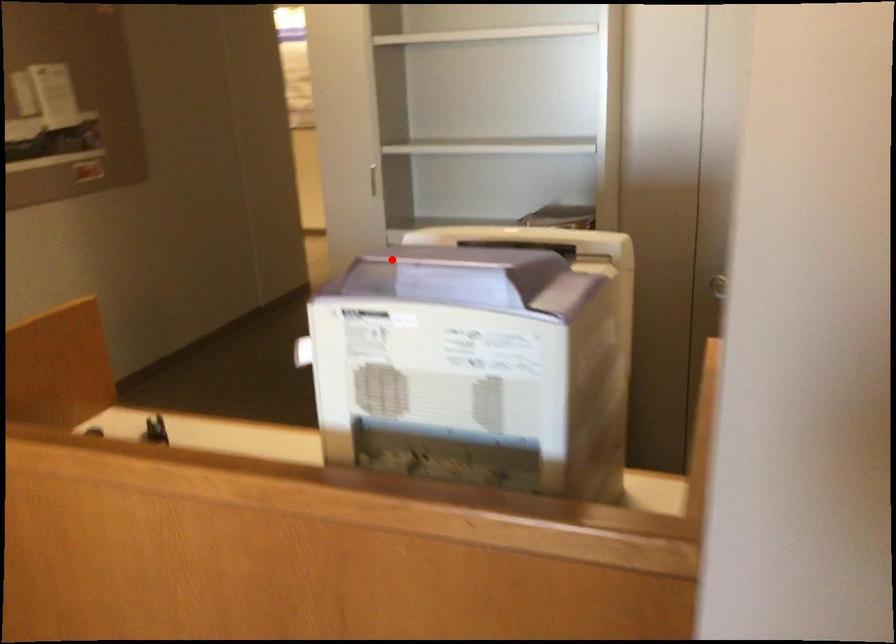
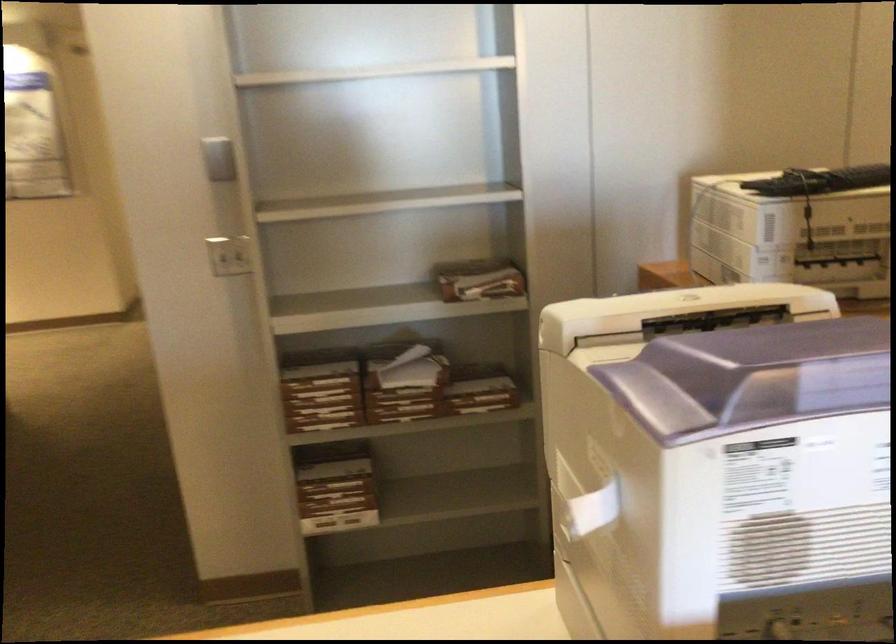
Question: I am providing you with two images of the same scene from different viewpoints. In image1, a red point is highlighted. Considering the same 3D point in image2, which of the following is correct?

Choices:
 (A) It is closer
 (B) It is farther

Answer: (A)